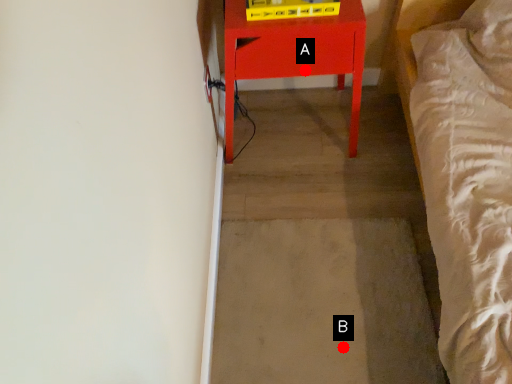
Question: Two points are circled on the image, labeled by A and B beside each circle. Which of the following is the farthest from the observer?

Choices:
 (A) A is further
 (B) B is further

Answer: (A)